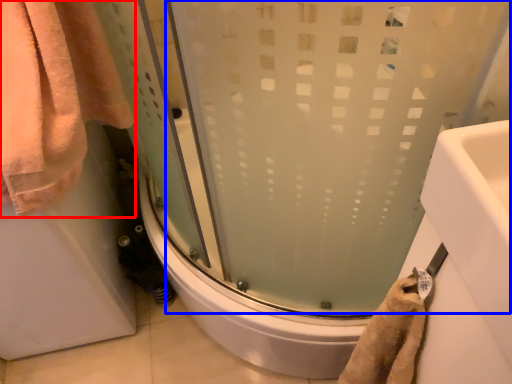
Question: Which of the following is the farthest to the observer, towel (highlighted by a red box) or shower door (highlighted by a blue box)?

Choices:
 (A) towel
 (B) shower door

Answer: (B)